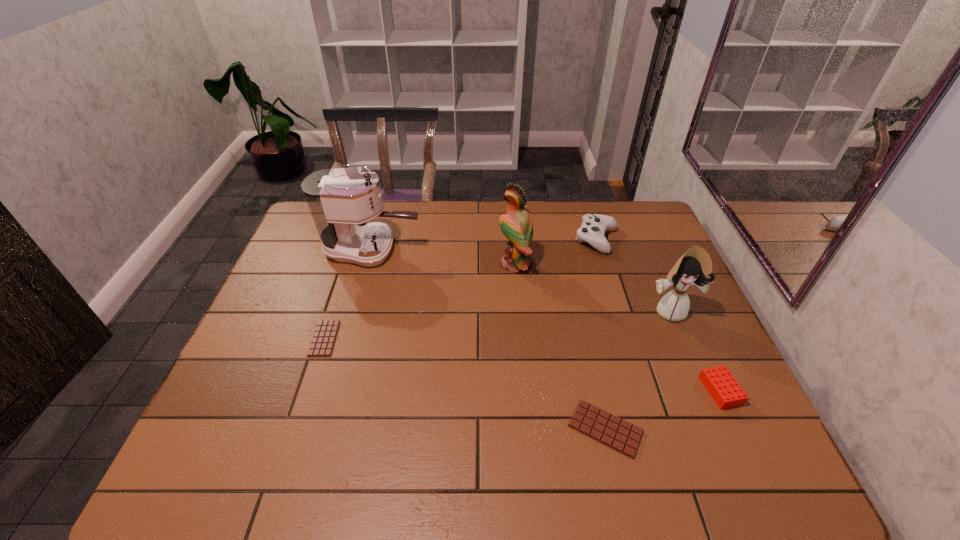
Locate an element on the screen. The image size is (960, 540). free space between the second shortest object and the coffee maker is located at coordinates (489, 339).

The image size is (960, 540). I want to click on free area in between the control and the right candy bar, so click(601, 334).

Locate an element on the screen. Image resolution: width=960 pixels, height=540 pixels. free area in between the Lego and the control is located at coordinates (659, 315).

You are a GUI agent. You are given a task and a screenshot of the screen. Output one action in this format:
    pyautogui.click(x=<x>, y=<y>)
    Task: Click on the free space between the left candy bar and the third object from left to right
    The width and height of the screenshot is (960, 540).
    Given the screenshot: What is the action you would take?
    pyautogui.click(x=420, y=301)

Locate an element on the screen. The width and height of the screenshot is (960, 540). free point between the shorter candy bar and the Lego is located at coordinates (522, 364).

The image size is (960, 540). Find the location of `vacant space that is in between the coffee maker and the taller candy bar`. vacant space that is in between the coffee maker and the taller candy bar is located at coordinates (489, 339).

Locate an element on the screen. This screenshot has width=960, height=540. the third closest object to the third object from left to right is located at coordinates (694, 268).

Find the location of a particular element. The image size is (960, 540). object that is the sixth closest to the control is located at coordinates [x=324, y=337].

The width and height of the screenshot is (960, 540). In order to click on vacant position in the image that satisfies the following two spatial constraints: 1. on the front-facing side of the fifth object from right to left; 2. on the back side of the right candy bar in this screenshot , I will do `click(530, 428)`.

Find the location of `free location that satisfies the following two spatial constraints: 1. on the front-facing side of the taller candy bar; 2. on the left side of the third object from left to right`. free location that satisfies the following two spatial constraints: 1. on the front-facing side of the taller candy bar; 2. on the left side of the third object from left to right is located at coordinates (530, 428).